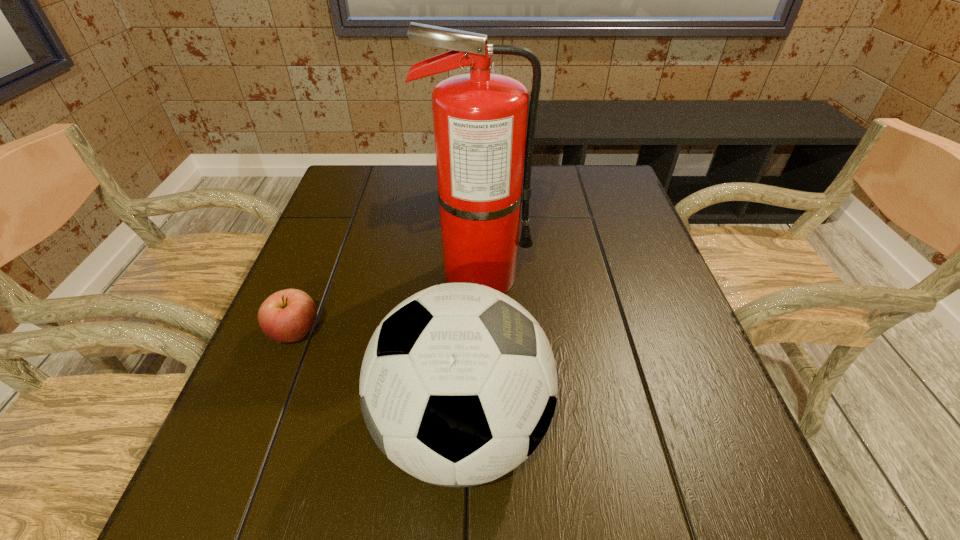
Identify the location of blank space located on the main logo of the soccer ball. (664, 429).

This screenshot has width=960, height=540. Identify the location of vacant region located on the front of the apple. (245, 457).

Where is `object that is at the far edge`? object that is at the far edge is located at coordinates (492, 70).

Identify the location of object that is at the near edge. Image resolution: width=960 pixels, height=540 pixels. (458, 384).

You are a GUI agent. You are given a task and a screenshot of the screen. Output one action in this format:
    pyautogui.click(x=<x>, y=<y>)
    Task: Click on the object that is at the left edge
    
    Given the screenshot: What is the action you would take?
    pyautogui.click(x=288, y=315)

At what (x,y) coordinates should I click in order to perform the action: click on vacant position at the far edge of the desktop. Please return your answer as a coordinate pair (x, y). Looking at the image, I should click on (542, 167).

In the image, there is a desktop. In order to click on free space at the near edge in this screenshot , I will do `click(372, 474)`.

In the image, there is a desktop. Identify the location of vacant space at the left edge. (319, 274).

Image resolution: width=960 pixels, height=540 pixels. In order to click on vacant space at the right edge in this screenshot , I will do `click(674, 357)`.

Where is `blank space at the far left corner of the desktop`? This screenshot has height=540, width=960. blank space at the far left corner of the desktop is located at coordinates (332, 192).